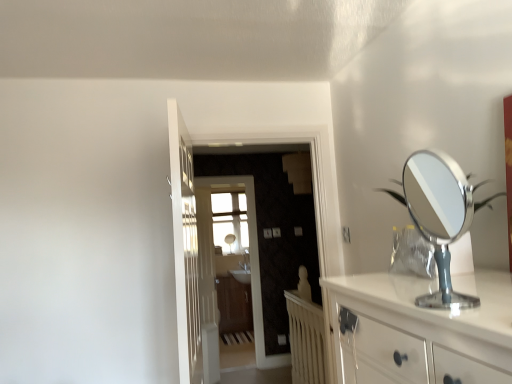
Where is `wooden cabinet at center`? wooden cabinet at center is located at coordinates (234, 305).

Measure the distance between point (226, 295) and camera.

Point (226, 295) is 16.17 feet away from camera.

You are a GUI agent. You are given a task and a screenshot of the screen. Output one action in this format:
    pyautogui.click(x=<x>, y=<y>)
    Task: Click on the white glossy door at center, which is counted as the 2th door, starting from the back
    
    Given the screenshot: What is the action you would take?
    pyautogui.click(x=185, y=248)

Describe the element at coordinates (306, 339) in the screenshot. The image size is (512, 384). I see `white wooden radiator at center` at that location.

Find the location of a particular element. The height and width of the screenshot is (384, 512). wooden cabinet at center is located at coordinates (234, 305).

Is wooden cabinet at center smaller than white glossy door at center, placed as the first door when sorted from front to back?

Incorrect, wooden cabinet at center is not smaller in size than white glossy door at center, placed as the first door when sorted from front to back.

Is the depth of wooden cabinet at center greater than that of white glossy door at center, placed as the first door when sorted from front to back?

Yes, the depth of wooden cabinet at center is greater than that of white glossy door at center, placed as the first door when sorted from front to back.

Does point (243, 301) come in front of point (168, 111)?

No.

Can you confirm if white glossy sink at center is positioned to the right of silver/metallic round mirror at right?

Incorrect, white glossy sink at center is not on the right side of silver/metallic round mirror at right.

Does point (245, 274) lie in front of point (459, 198)?

That is False.

From the picture: From a real-world perspective, is white glossy sink at center under silver/metallic round mirror at right?

Yes, from a real-world perspective, white glossy sink at center is below silver/metallic round mirror at right.

Is the position of white glossy sink at center less distant than that of silver/metallic round mirror at right?

No.

Between white wooden door at center, which is counted as the first door, starting from the back, and clear glass door at center, the 1th screen door from the back, which one has smaller width?

clear glass door at center, the 1th screen door from the back, is thinner.

Is white wooden door at center, the first door positioned from the left, bigger or smaller than clear glass door at center, the second screen door positioned from the front?

In the image, white wooden door at center, the first door positioned from the left, appears to be smaller than clear glass door at center, the second screen door positioned from the front.

Relative to clear glass door at center, the second screen door positioned from the front, is white wooden door at center, the first door positioned from the left, in front or behind?

white wooden door at center, the first door positioned from the left, is positioned farther from the viewer than clear glass door at center, the second screen door positioned from the front.

From the image's perspective, is white wooden door at center, the first door positioned from the left, located above or below white wooden radiator at center?

white wooden door at center, the first door positioned from the left, is situated higher than white wooden radiator at center in the image.

This screenshot has width=512, height=384. Identify the location of the 1st door directly above the white wooden radiator at center (from a real-world perspective). (207, 287).

Is white wooden door at center, the second door in the front-to-back sequence, oriented towards white wooden radiator at center?

No, white wooden door at center, the second door in the front-to-back sequence, does not turn towards white wooden radiator at center.

From a real-world perspective, who is located higher, white wooden door at center, arranged as the 2th door when viewed from the right, or white wooden radiator at center?

From a 3D spatial view, white wooden door at center, arranged as the 2th door when viewed from the right, is above.

Is white glossy sink at center inside the boundaries of white wooden radiator at center, or outside?

white glossy sink at center is outside white wooden radiator at center.

Is white glossy sink at center shorter than white wooden radiator at center?

Yes, white glossy sink at center is shorter than white wooden radiator at center.

From the image's perspective, is matte wood screen door at center, positioned as the 2th screen door in back-to-front order, on silver/metallic round mirror at right?

Actually, matte wood screen door at center, positioned as the 2th screen door in back-to-front order, appears below silver/metallic round mirror at right in the image.

In the scene shown: Is matte wood screen door at center, the first screen door in the front-to-back sequence, turned away from silver/metallic round mirror at right?

No, silver/metallic round mirror at right is not at the back of matte wood screen door at center, the first screen door in the front-to-back sequence.

Which is more distant, (255, 205) or (413, 186)?

The point (255, 205) is farther from the camera.

How many degrees apart are the facing directions of matte wood screen door at center, the first screen door in the front-to-back sequence, and silver/metallic round mirror at right?

The angular difference between matte wood screen door at center, the first screen door in the front-to-back sequence, and silver/metallic round mirror at right is 86 degrees.

Could you tell me if clear glass door at center, the 1th screen door from the back, is turned towards matte wood screen door at center, positioned as the 2th screen door in back-to-front order?

Yes, clear glass door at center, the 1th screen door from the back, is turned towards matte wood screen door at center, positioned as the 2th screen door in back-to-front order.

Which of these two, clear glass door at center, the second screen door positioned from the front, or matte wood screen door at center, the first screen door in the front-to-back sequence, stands taller?

clear glass door at center, the second screen door positioned from the front, is taller.

How different are the orientations of clear glass door at center, the second screen door positioned from the front, and matte wood screen door at center, the first screen door in the front-to-back sequence, in degrees?

clear glass door at center, the second screen door positioned from the front, and matte wood screen door at center, the first screen door in the front-to-back sequence, are facing 0.000241 degrees away from each other.

From a real-world perspective, between clear glass door at center, the second screen door positioned from the front, and matte wood screen door at center, positioned as the 2th screen door in back-to-front order, who is vertically higher?

matte wood screen door at center, positioned as the 2th screen door in back-to-front order.

From the wooden cabinet at center, count 2nd doors forward and point to it. Please provide its 2D coordinates.

[(185, 248)]

Locate an element on the screen. This screenshot has width=512, height=384. sink on the left of silver/metallic round mirror at right is located at coordinates [x=241, y=275].

In the scene shown: Looking at the image, which one is located further to white wooden door at center, arranged as the 2th door when viewed from the right, white wooden radiator at center or white glossy sink at center?

white wooden radiator at center lies further to white wooden door at center, arranged as the 2th door when viewed from the right, than the other object.

From the picture: Estimate the real-world distances between objects in this image. Which object is closer to white wooden radiator at center, white wooden door at center, which is counted as the first door, starting from the back, or silver/metallic round mirror at right?

The object closer to white wooden radiator at center is white wooden door at center, which is counted as the first door, starting from the back.

From the image, which object appears to be farther from clear glass door at center, the 1th screen door from the back, matte wood screen door at center, the first screen door in the front-to-back sequence, or wooden cabinet at center?

wooden cabinet at center is further to clear glass door at center, the 1th screen door from the back.

Looking at this image, from the image, which object appears to be nearer to clear glass door at center, the second screen door positioned from the front, silver/metallic round mirror at right or white wooden radiator at center?

white wooden radiator at center is positioned closer to the anchor clear glass door at center, the second screen door positioned from the front.

Estimate the real-world distances between objects in this image. Which object is closer to silver/metallic round mirror at right, clear glass door at center, the second screen door positioned from the front, or white wooden door at center, arranged as the 2th door when viewed from the right?

clear glass door at center, the second screen door positioned from the front, lies closer to silver/metallic round mirror at right than the other object.

From the image, which object appears to be nearer to wooden cabinet at center, white wooden door at center, which is counted as the first door, starting from the back, or silver/metallic round mirror at right?

Based on the image, white wooden door at center, which is counted as the first door, starting from the back, appears to be nearer to wooden cabinet at center.

Based on their spatial positions, is silver/metallic round mirror at right or clear glass door at center, the second screen door positioned from the front, further from wooden cabinet at center?

silver/metallic round mirror at right.

When comparing their distances from white glossy sink at center, does white wooden door at center, the first door positioned from the left, or white wooden radiator at center seem closer?

white wooden door at center, the first door positioned from the left, is positioned closer to the anchor white glossy sink at center.

Identify the location of radiator located between white glossy door at center, which is the first door in right-to-left order, and clear glass door at center, the 1th screen door from the back, in the depth direction. (306, 339).

Identify the location of radiator located between matte wood screen door at center, positioned as the 2th screen door in back-to-front order, and white wooden door at center, the second door in the front-to-back sequence, in the depth direction. The width and height of the screenshot is (512, 384). click(x=306, y=339).

The width and height of the screenshot is (512, 384). In order to click on door between white wooden radiator at center and white glossy sink at center from front to back in this screenshot , I will do `click(207, 287)`.

At what (x,y) coordinates should I click in order to perform the action: click on radiator positioned between matte wood screen door at center, the first screen door in the front-to-back sequence, and clear glass door at center, the second screen door positioned from the front, from near to far. Please return your answer as a coordinate pair (x, y). This screenshot has height=384, width=512. Looking at the image, I should click on (306, 339).